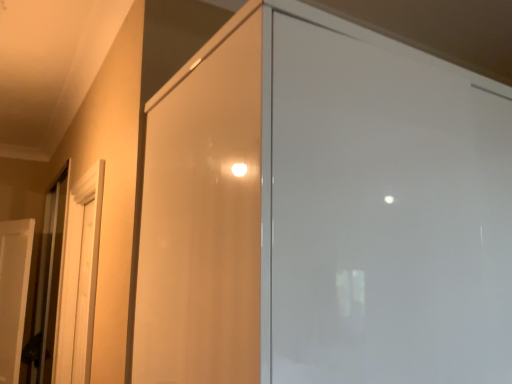
Question: In the image, is white matte door at left positioned in front of or behind matte wood screen door at left, the second screen door when ordered from right to left?

Choices:
 (A) behind
 (B) front

Answer: (A)

Question: From the image's perspective, relative to matte wood screen door at left, the 1th screen door positioned from the back, is white matte door at left above or below?

Choices:
 (A) above
 (B) below

Answer: (B)

Question: Which object is the farthest from the metallic elevator door at left?

Choices:
 (A) white matte door at left
 (B) matte wood screen door at left, marked as the 1th screen door in a left-to-right arrangement
 (C) transparent glass screen door at center, the 2th screen door when ordered from left to right

Answer: (C)

Question: Which is farther from the matte wood screen door at left, the second screen door positioned from the front?

Choices:
 (A) transparent glass screen door at center, the first screen door positioned from the front
 (B) white matte door at left
 (C) metallic elevator door at left

Answer: (A)